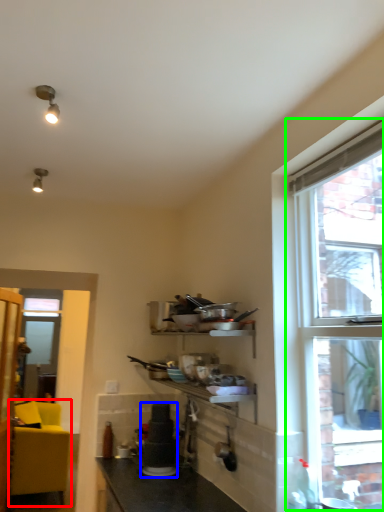
Question: Which is nearer to the studio couch (highlighted by a red box)? appliance (highlighted by a blue box) or window (highlighted by a green box).

Choices:
 (A) appliance
 (B) window

Answer: (A)